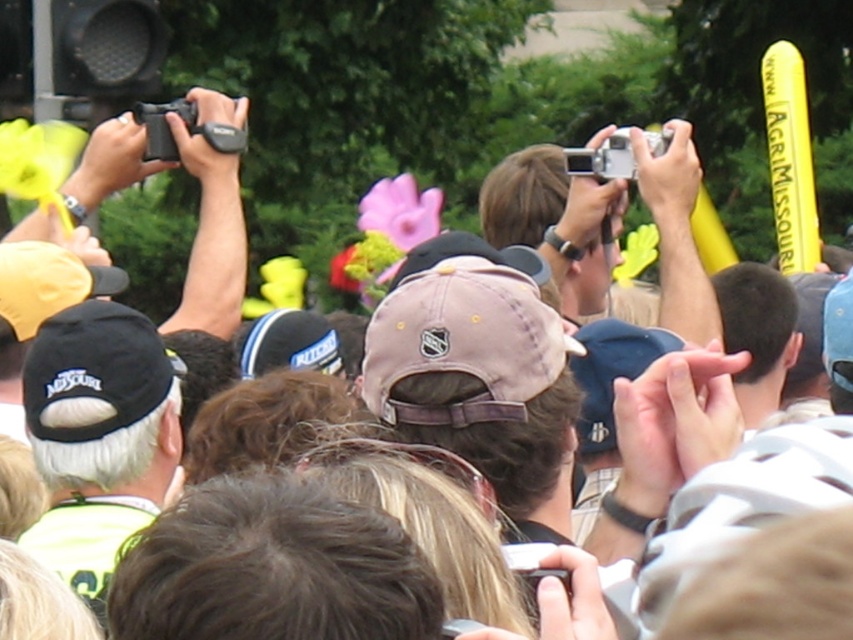
Is light brown fabric baseball cap at center taller than black fabric cap at left?

No.

Which is in front, point (514, 298) or point (77, 456)?

Point (514, 298) is in front.

At what (x,y) coordinates should I click in order to perform the action: click on light brown fabric baseball cap at center. Please return your answer as a coordinate pair (x, y). Looking at the image, I should click on (479, 380).